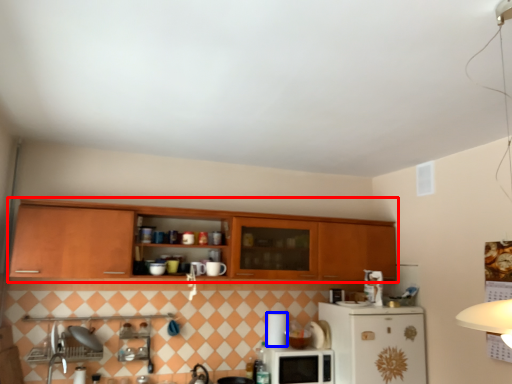
Question: Which of the following is the farthest to the observer, cabinetry (highlighted by a red box) or appliance (highlighted by a blue box)?

Choices:
 (A) cabinetry
 (B) appliance

Answer: (B)